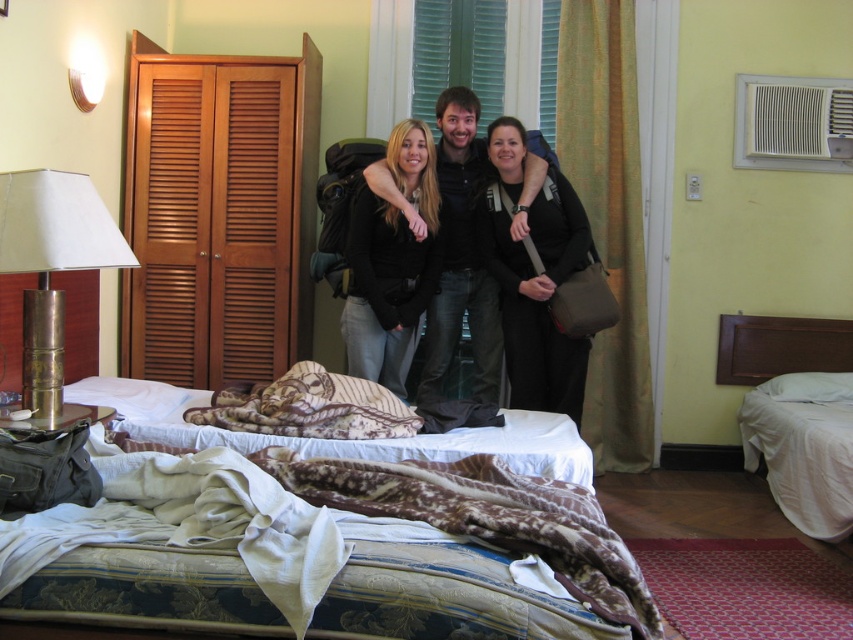
Does black fabric backpack at center have a greater width compared to white fabric bed at right?

No, black fabric backpack at center is not wider than white fabric bed at right.

Does black fabric backpack at center have a greater height compared to white fabric bed at right?

Indeed, black fabric backpack at center has a greater height compared to white fabric bed at right.

Image resolution: width=853 pixels, height=640 pixels. What do you see at coordinates (534, 278) in the screenshot?
I see `black fabric backpack at center` at bounding box center [534, 278].

This screenshot has width=853, height=640. Identify the location of black fabric backpack at center. (534, 278).

Is point (352, 570) positioned in front of point (3, 269)?

Yes.

Who is higher up, patterned fabric bed at center or brass/textured lamp at left?

brass/textured lamp at left

Which is behind, point (61, 573) or point (57, 259)?

The point (57, 259) is more distant.

Identify the location of patterned fabric bed at center. (276, 552).

Does black matte jacket at center lie in front of brass/textured lamp at left?

No, black matte jacket at center is further to the viewer.

Find the location of a particular element. Image resolution: width=853 pixels, height=640 pixels. black matte jacket at center is located at coordinates (392, 262).